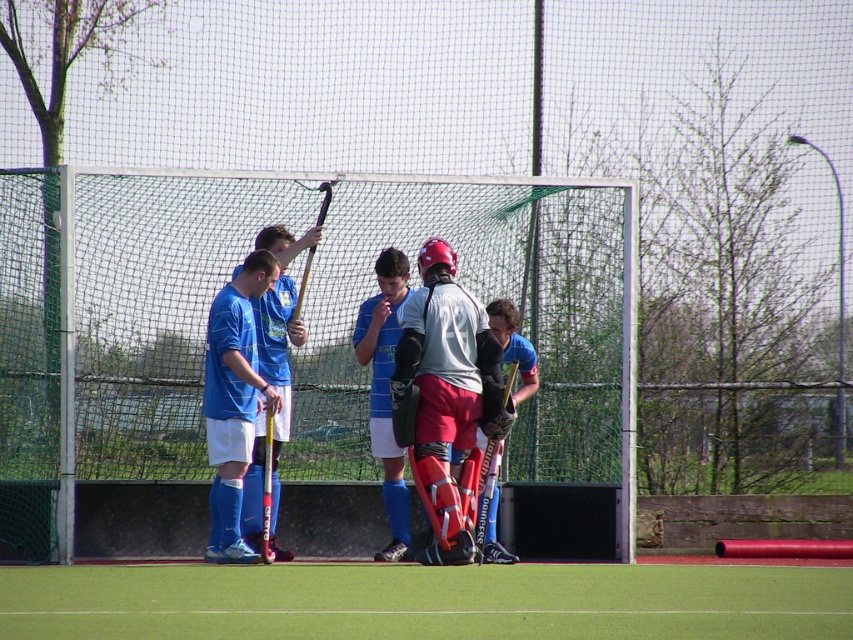
Consider the image. Measure the distance between matte gray jersey at center and camera.

The distance of matte gray jersey at center from camera is 43.76 feet.

Consider the image. Is matte gray jersey at center further to camera compared to blue jersey at left?

Yes, matte gray jersey at center is further from the viewer.

The image size is (853, 640). I want to click on matte gray jersey at center, so click(445, 394).

Does matte gray jersey at center have a larger size compared to matte blue shirt at center?

Indeed, matte gray jersey at center has a larger size compared to matte blue shirt at center.

Is matte gray jersey at center to the left of matte blue shirt at center from the viewer's perspective?

Incorrect, matte gray jersey at center is not on the left side of matte blue shirt at center.

Is point (439, 490) positioned before point (277, 330)?

That is True.

The height and width of the screenshot is (640, 853). Find the location of `matte gray jersey at center`. matte gray jersey at center is located at coordinates (445, 394).

Who is taller, blue jersey at left or matte black hockey stick at center?

blue jersey at left is taller.

Is blue jersey at left bigger than matte black hockey stick at center?

Yes.

What do you see at coordinates (233, 401) in the screenshot?
I see `blue jersey at left` at bounding box center [233, 401].

Find the location of a particular element. This screenshot has height=640, width=853. blue jersey at left is located at coordinates (233, 401).